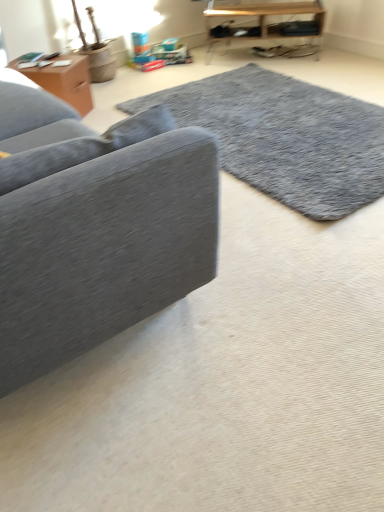
Question: Is the depth of wooden shelf at upper right, acting as the 1th table starting from the top, greater than that of matte brown wooden table at upper left, which is the 2th table from back to front?

Choices:
 (A) yes
 (B) no

Answer: (A)

Question: From a real-world perspective, is wooden shelf at upper right, positioned as the first table in back-to-front order, on top of matte brown wooden table at upper left, arranged as the 2th table when viewed from the top?

Choices:
 (A) yes
 (B) no

Answer: (A)

Question: From the image's perspective, is wooden shelf at upper right, placed as the 2th table when sorted from front to back, above matte brown wooden table at upper left, which ranks as the first table in front-to-back order?

Choices:
 (A) yes
 (B) no

Answer: (A)

Question: Could you tell me if wooden shelf at upper right, placed as the 2th table when sorted from front to back, is facing matte brown wooden table at upper left, the 2th table from the right?

Choices:
 (A) no
 (B) yes

Answer: (A)

Question: Does wooden shelf at upper right, positioned as the 2th table in left-to-right order, have a larger size compared to matte brown wooden table at upper left, the 2th table from the right?

Choices:
 (A) no
 (B) yes

Answer: (B)

Question: From a real-world perspective, is wooden shelf at upper right, positioned as the 2th table in left-to-right order, beneath matte brown wooden table at upper left, arranged as the 2th table when viewed from the top?

Choices:
 (A) no
 (B) yes

Answer: (A)

Question: Is wooden shelf at upper right, acting as the 1th table starting from the top, positioned before gray shaggy rug at center?

Choices:
 (A) no
 (B) yes

Answer: (A)

Question: Are wooden shelf at upper right, which is the 2th table from bottom to top, and gray shaggy rug at center beside each other?

Choices:
 (A) yes
 (B) no

Answer: (B)

Question: Does wooden shelf at upper right, placed as the 2th table when sorted from front to back, have a smaller size compared to gray shaggy rug at center?

Choices:
 (A) no
 (B) yes

Answer: (A)

Question: From a real-world perspective, does wooden shelf at upper right, the 1th table in the right-to-left sequence, sit lower than gray shaggy rug at center?

Choices:
 (A) yes
 (B) no

Answer: (B)

Question: Considering the relative sizes of wooden shelf at upper right, acting as the 1th table starting from the top, and gray shaggy rug at center in the image provided, is wooden shelf at upper right, acting as the 1th table starting from the top, wider than gray shaggy rug at center?

Choices:
 (A) yes
 (B) no

Answer: (B)

Question: Is wooden shelf at upper right, positioned as the 2th table in left-to-right order, looking in the opposite direction of gray shaggy rug at center?

Choices:
 (A) no
 (B) yes

Answer: (A)

Question: Is wooden shelf at upper right, positioned as the first table in back-to-front order, located within velvet gray couch at left?

Choices:
 (A) no
 (B) yes

Answer: (A)